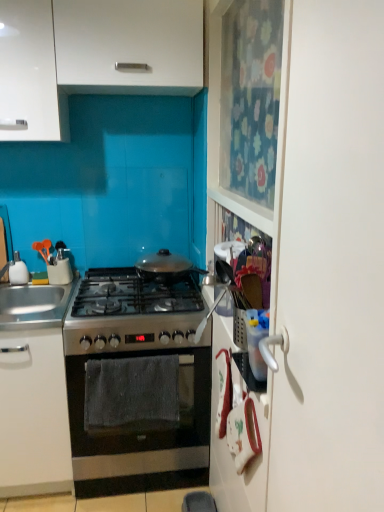
Identify the location of vacant space to the right of white glossy soap dispenser at left. This screenshot has height=512, width=384. (55, 285).